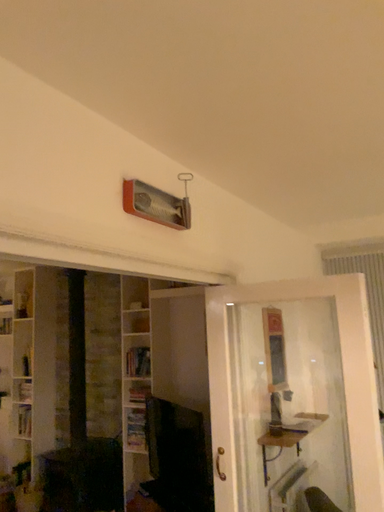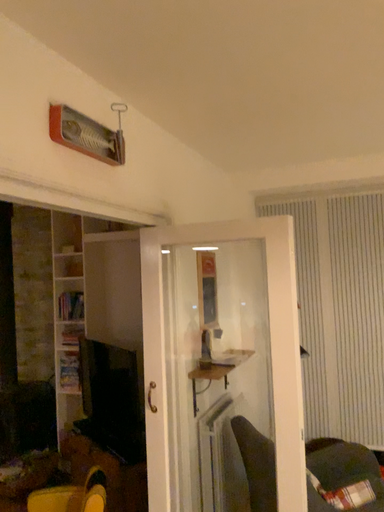
Question: Which way did the camera rotate in the video?

Choices:
 (A) rotated downward
 (B) rotated upward

Answer: (A)